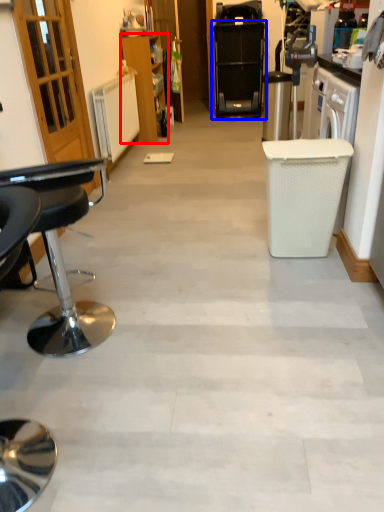
Question: Which of the following is the farthest to the observer, cabinetry (highlighted by a red box) or home appliance (highlighted by a blue box)?

Choices:
 (A) cabinetry
 (B) home appliance

Answer: (B)